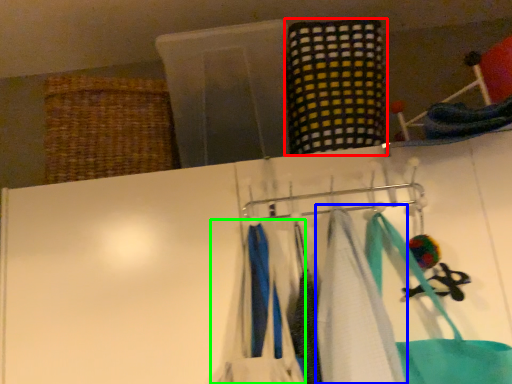
Question: Based on their relative distances, which object is farther from clothing (highlighted by a red box)? Choose from towel (highlighted by a blue box) and clothing (highlighted by a green box).

Choices:
 (A) towel
 (B) clothing

Answer: (B)